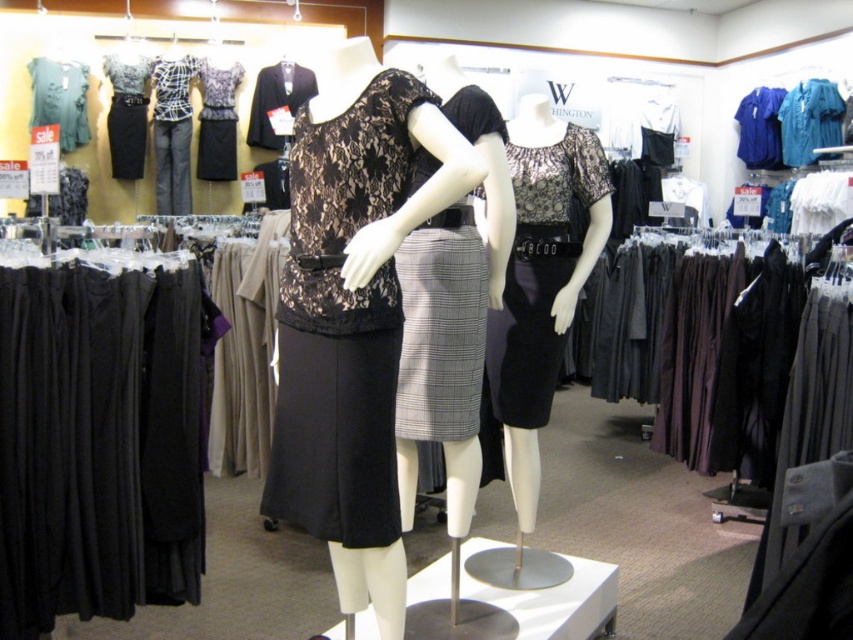
Between lace fabric dress at center and gray wool skirt at center, which one has less height?

lace fabric dress at center is shorter.

Is point (341, 164) farther from camera compared to point (428, 156)?

That is False.

Is point (306, 410) more distant than point (453, 358)?

No, (306, 410) is in front of (453, 358).

This screenshot has height=640, width=853. In order to click on lace fabric dress at center in this screenshot , I will do `click(341, 324)`.

Between gray wool skirt at center and lace fabric blouse at upper center, which one has less height?

Standing shorter between the two is lace fabric blouse at upper center.

Is gray wool skirt at center below lace fabric blouse at upper center?

Correct, gray wool skirt at center is located below lace fabric blouse at upper center.

Is point (466, 432) behind point (207, 102)?

No, (466, 432) is closer to viewer.

At what (x,y) coordinates should I click in order to perform the action: click on gray wool skirt at center. Please return your answer as a coordinate pair (x, y). Looking at the image, I should click on (451, 310).

Can you confirm if lace fabric dress at center is positioned below black textured dress at center?

Yes, lace fabric dress at center is below black textured dress at center.

Is point (370, 353) positioned after point (534, 406)?

No, (370, 353) is in front of (534, 406).

Where is `lace fabric dress at center`? This screenshot has width=853, height=640. lace fabric dress at center is located at coordinates (341, 324).